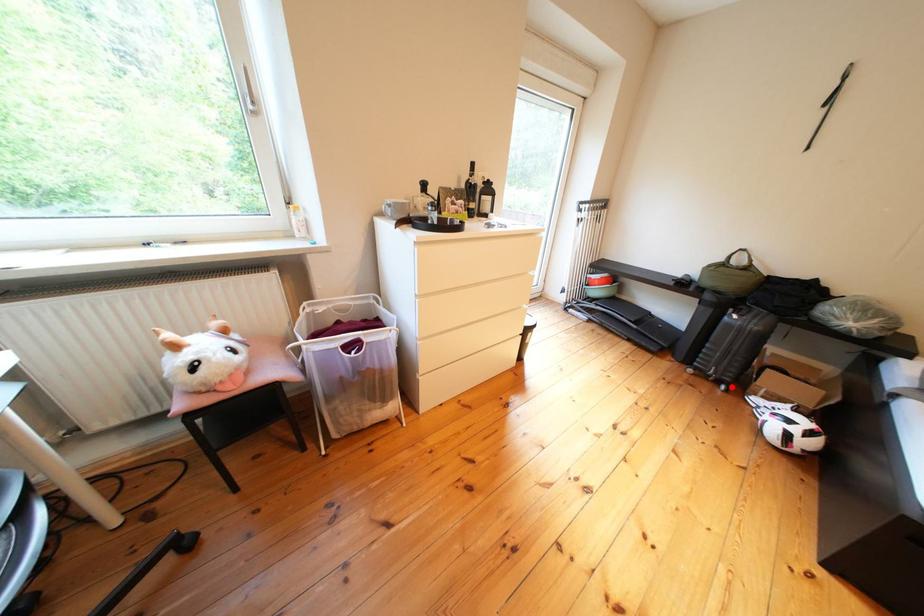
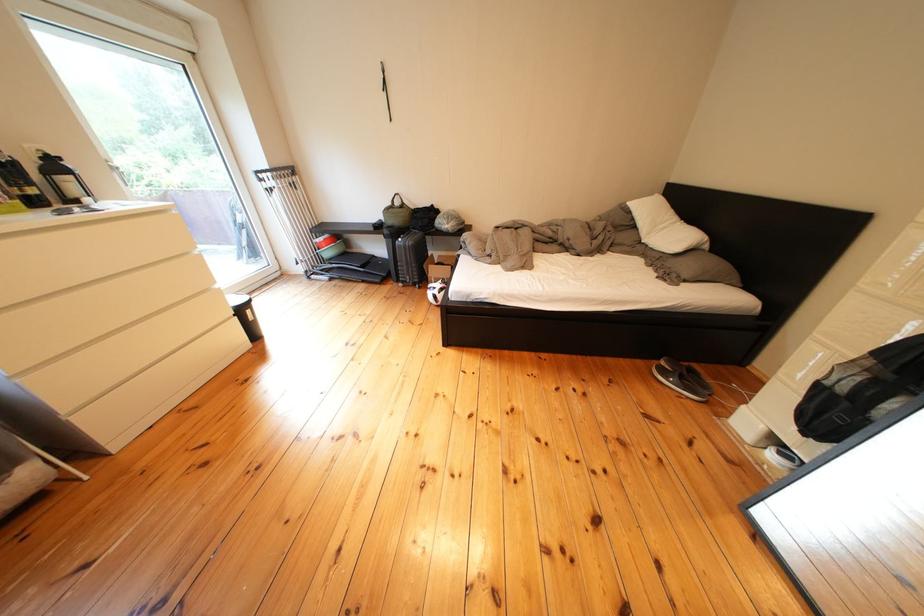
Question: I am providing you with two images of the same scene from different viewpoints. Image1 has a red point marked. In image2, the corresponding 3D location appears at what relative position? Reply with the corresponding letter.

Choices:
 (A) Closer
 (B) Farther

Answer: (B)